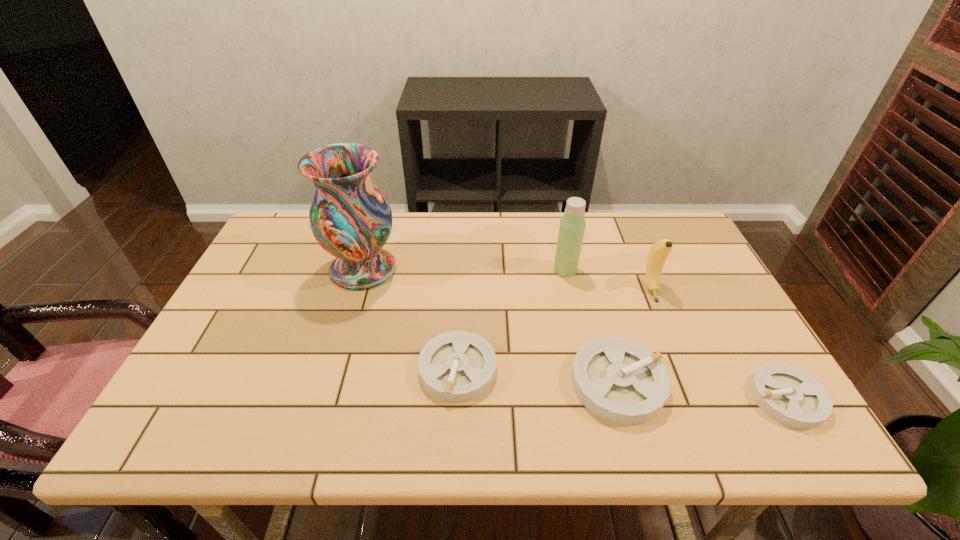
This screenshot has width=960, height=540. In order to click on free space located 0.270m on the right of the second tallest ashtray in this screenshot , I will do `click(612, 369)`.

Locate an element on the screen. free space located on the right of the second ashtray from right to left is located at coordinates (708, 383).

This screenshot has width=960, height=540. Find the location of `free space located on the back of the rightmost ashtray`. free space located on the back of the rightmost ashtray is located at coordinates (706, 260).

Where is `vacant space located on the front of the thermos bottle`? This screenshot has height=540, width=960. vacant space located on the front of the thermos bottle is located at coordinates (581, 340).

At what (x,y) coordinates should I click in order to perform the action: click on blank space located 0.250m on the right of the vase. Please return your answer as a coordinate pair (x, y). Looking at the image, I should click on (485, 269).

Identify the location of blank space located 0.210m from the stem of the banana. (683, 366).

Identify the location of object that is at the far edge. This screenshot has height=540, width=960. (351, 219).

Where is `object located at the right edge`? object located at the right edge is located at coordinates (789, 395).

Locate an element on the screen. The height and width of the screenshot is (540, 960). object that is at the near right corner is located at coordinates (789, 395).

Image resolution: width=960 pixels, height=540 pixels. In the image, there is a desktop. What are the coordinates of `vacant space at the far edge` in the screenshot? It's located at (405, 219).